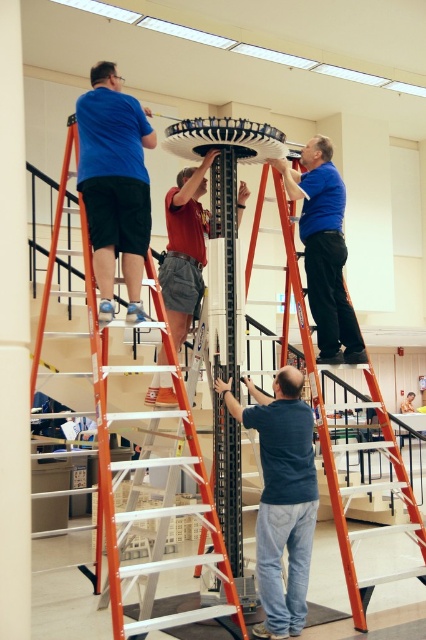
Can you confirm if matte blue shirt at upper left is smaller than reddish-brown fabric shirt at center?

Indeed, matte blue shirt at upper left has a smaller size compared to reddish-brown fabric shirt at center.

Image resolution: width=426 pixels, height=640 pixels. What are the coordinates of `matte blue shirt at upper left` in the screenshot? It's located at (115, 184).

Does point (172, 506) come behind point (324, 282)?

No, it is in front of (324, 282).

Can you confirm if orange plastic ladder at center is positioned above matte blue shirt at upper center?

No.

This screenshot has height=640, width=426. Find the location of `orange plastic ladder at center`. orange plastic ladder at center is located at coordinates (120, 417).

This screenshot has height=640, width=426. What are the coordinates of `orange plastic ladder at center` in the screenshot? It's located at (120, 417).

Is matte blue shirt at upper center closer to camera compared to reddish-brown fabric shirt at center?

No, it is not.

Does matte blue shirt at upper center appear on the right side of reddish-brown fabric shirt at center?

Correct, you'll find matte blue shirt at upper center to the right of reddish-brown fabric shirt at center.

Is point (322, 209) positioned in front of point (216, 150)?

That is False.

Image resolution: width=426 pixels, height=640 pixels. Find the location of `matte blue shirt at upper center`. matte blue shirt at upper center is located at coordinates (324, 250).